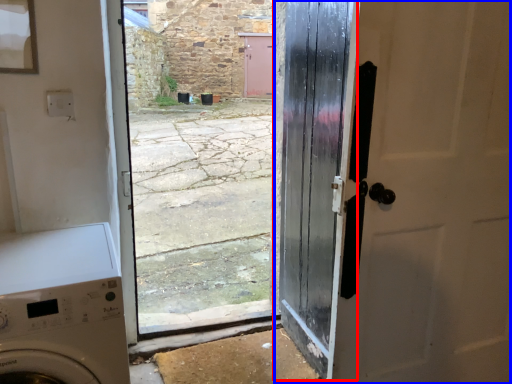
Question: Which of the following is the closest to the observer, door (highlighted by a red box) or door (highlighted by a blue box)?

Choices:
 (A) door
 (B) door

Answer: (B)